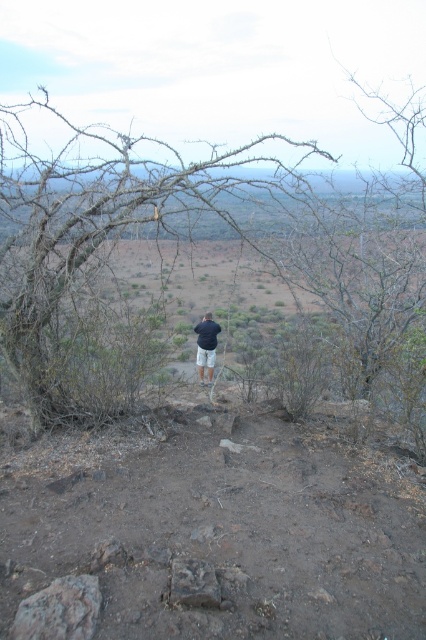
Is point (74, 381) positioned before point (213, 330)?

Yes, it is in front of point (213, 330).

Who is shorter, brown dry branches at upper left or dark blue shirt at center?

With less height is dark blue shirt at center.

Is point (46, 163) in front of point (199, 348)?

Yes, point (46, 163) is in front of point (199, 348).

You are a GUI agent. You are given a task and a screenshot of the screen. Output one action in this format:
    pyautogui.click(x=<x>, y=<y>)
    Task: Click on the brown dry branches at upper left
    This screenshot has height=640, width=426.
    Given the screenshot: What is the action you would take?
    pyautogui.click(x=92, y=248)